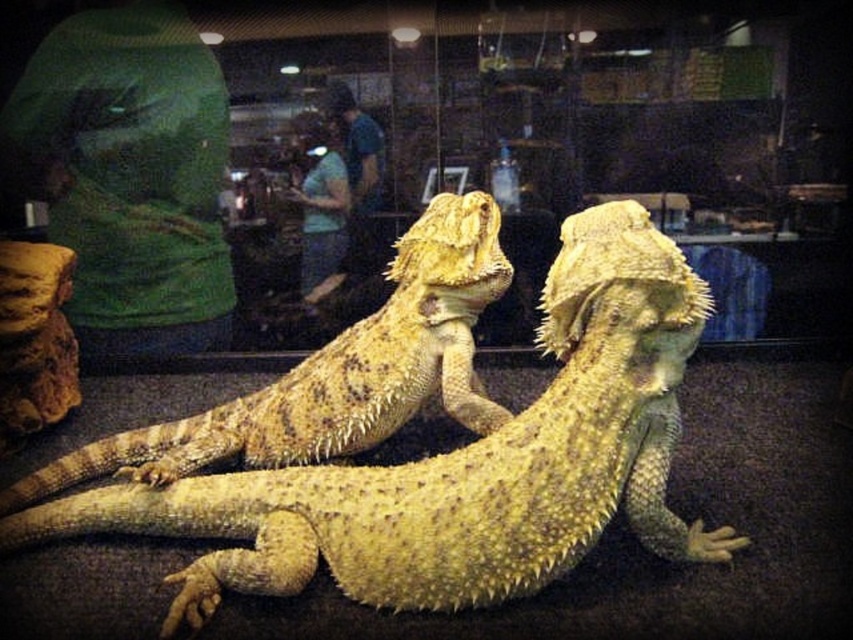
You are standing in front of an enclosure with two bearded dragons. You notice two points marked on the enclosure glass at coordinates point [583,456] and point [422,388]. Which point is closer to your eyes?

Point [583,456] is closer to the viewer than point [422,388].

Looking at this image, you are a researcher studying reptiles in a pet store. You need to locate the yellow scaly lizard at center. According to the coordinates provided, where exactly is it positioned?

The yellow scaly lizard at center is positioned at coordinates point (x=463, y=464).

You are a visitor at the pet store and want to take a photo of both the yellow scaly lizard at center and the yellow spiny lizard at center. Which lizard should you focus on first to ensure both are in clear view?

You should focus on the yellow scaly lizard at center first since it is closer to the viewer, allowing the yellow spiny lizard at center to also be in focus when adjusting the camera settings.